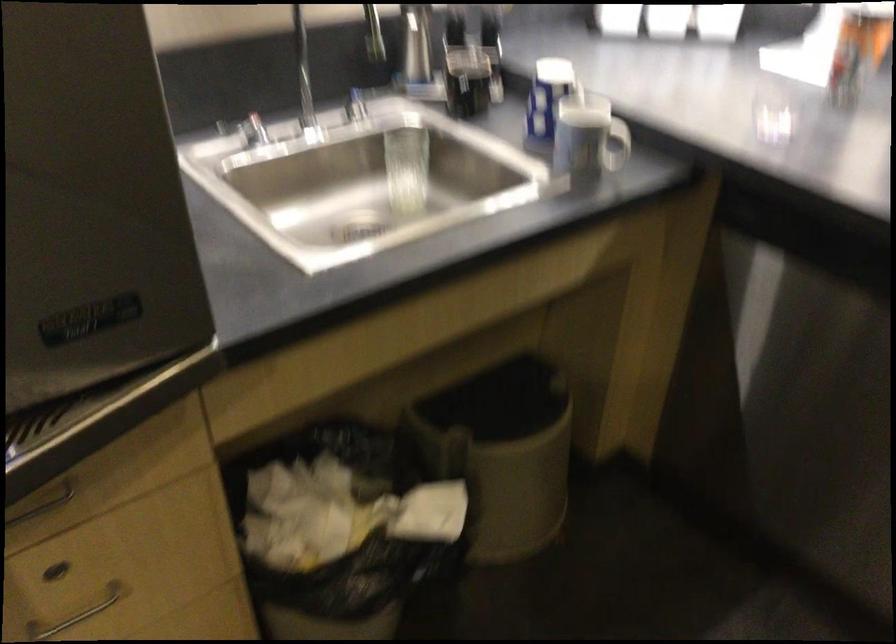
The location [588,146] corresponds to which object?

This point indicates the blue and white cup.